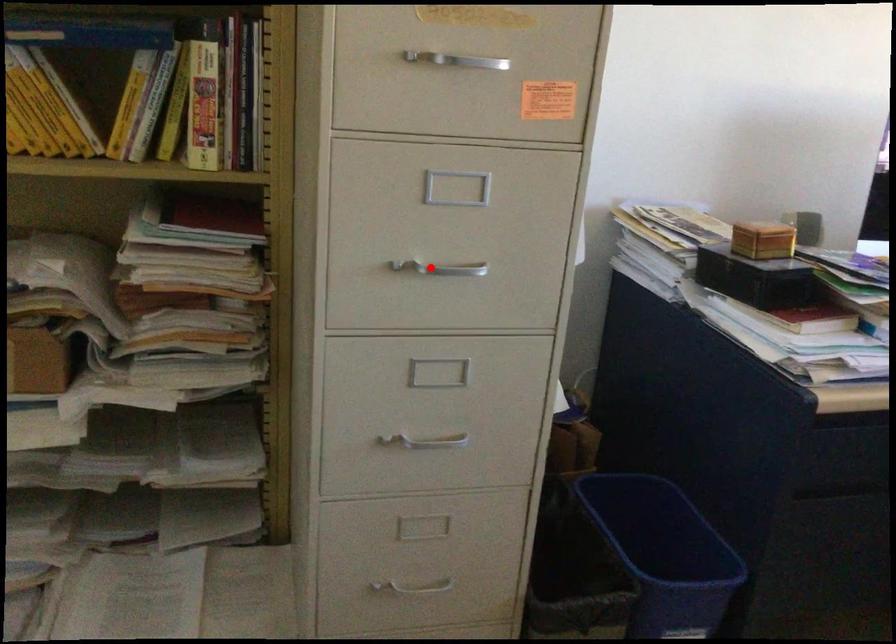
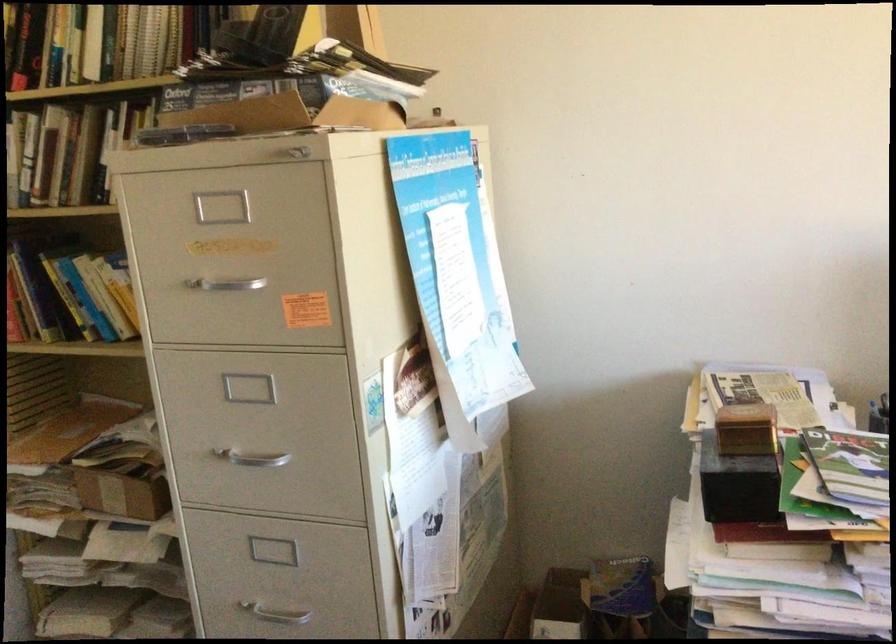
Where in the second image is the point corresponding to the highlighted location from the first image?

(251, 458)